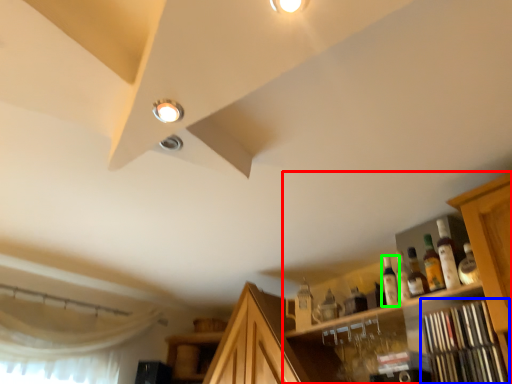
Question: Which object is positioned closest to cabinetry (highlighted by a red box)? Select from shelf (highlighted by a blue box) and bottle (highlighted by a green box).

Choices:
 (A) shelf
 (B) bottle

Answer: (A)